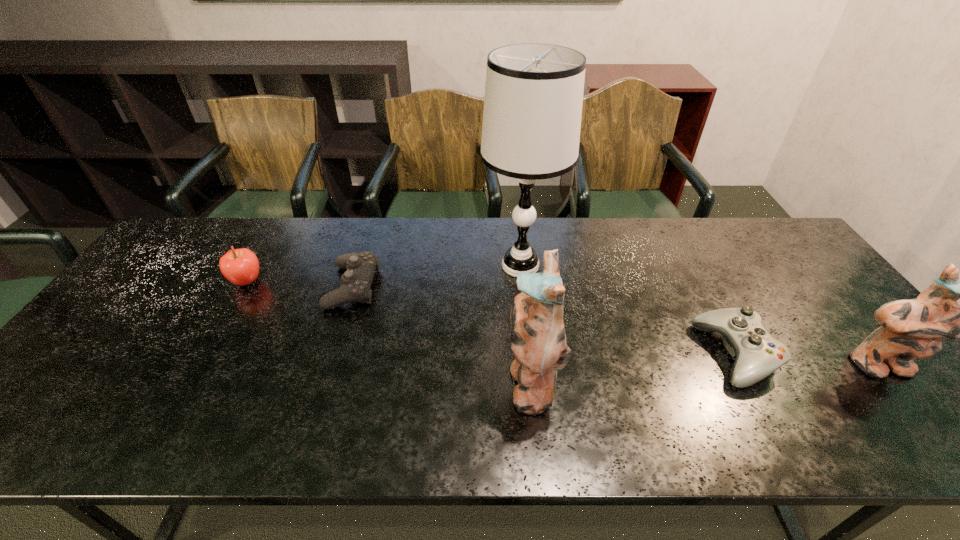
Locate an element on the screen. This screenshot has height=540, width=960. free spot between the leftmost object and the farther control is located at coordinates (300, 284).

Find the location of a particular element. The image size is (960, 540). unoccupied area between the leftmost object and the taller figurine is located at coordinates (389, 332).

Identify the location of vacant region between the fifth shortest object and the fifth object from right to left. This screenshot has height=540, width=960. (443, 335).

Identify the location of empty space that is in between the nearer control and the tallest object. (628, 310).

The width and height of the screenshot is (960, 540). I want to click on vacant area that lies between the apple and the fifth object from left to right, so click(x=492, y=318).

You are a GUI agent. You are given a task and a screenshot of the screen. Output one action in this format:
    pyautogui.click(x=<x>, y=<y>)
    Task: Click on the free point between the left figurine and the apple
    
    Given the screenshot: What is the action you would take?
    pyautogui.click(x=389, y=332)

Find the location of a particular element. object that is the third nearest to the taller figurine is located at coordinates (360, 267).

Identify which object is the third closest to the fifth object from left to right. Please provide its 2D coordinates. Your answer should be formatted as a tuple, i.e. [(x, y)], where the tuple contains the x and y coordinates of a point satisfying the conditions above.

[(538, 338)]

Image resolution: width=960 pixels, height=540 pixels. I want to click on vacant space that satisfies the following two spatial constraints: 1. on the front side of the fourth tallest object; 2. on the left side of the fifth object from right to left, so click(244, 287).